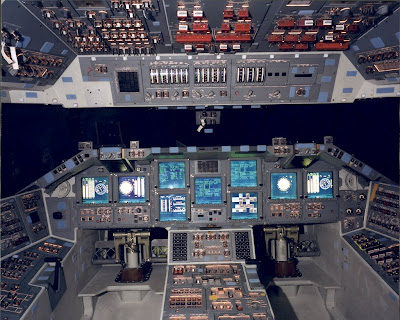
The width and height of the screenshot is (400, 320). Find the location of `gray walls`. gray walls is located at coordinates [x=361, y=291].